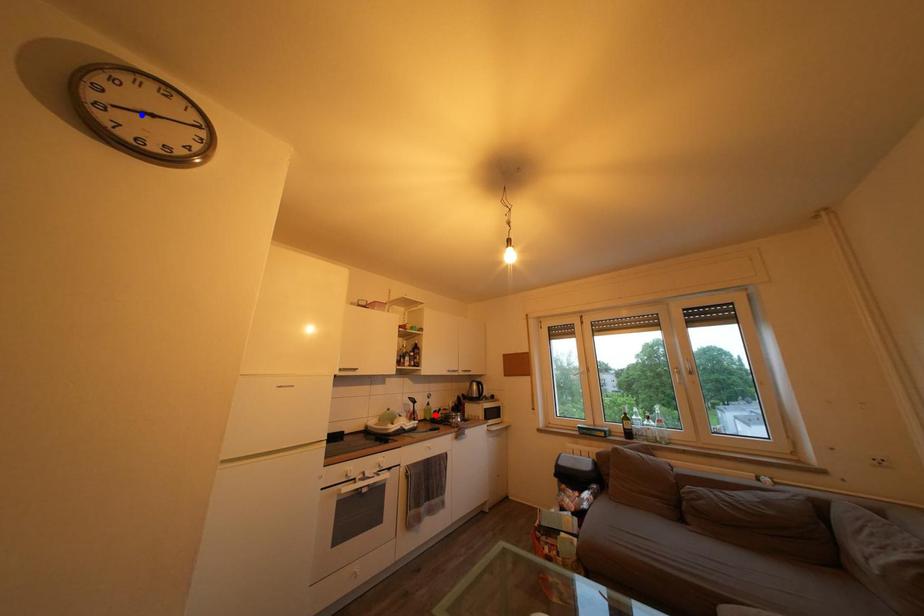
Question: In the image, two points are highlighted. Which point is nearer to the camera? Reply with the corresponding letter.

Choices:
 (A) blue point
 (B) red point

Answer: (A)